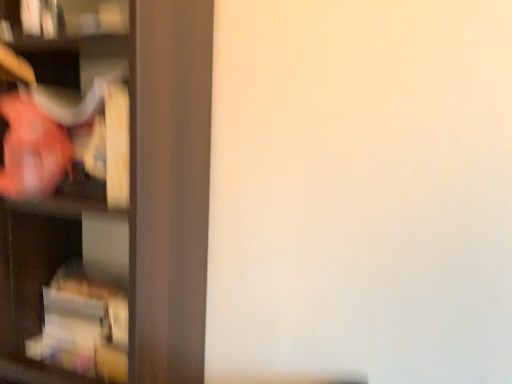
Question: Is matte brown shelf at left at the left side of matte plastic cabinet at left?

Choices:
 (A) yes
 (B) no

Answer: (B)

Question: From a real-world perspective, does matte brown shelf at left stand above matte plastic cabinet at left?

Choices:
 (A) yes
 (B) no

Answer: (A)

Question: Is matte brown shelf at left not inside matte plastic cabinet at left?

Choices:
 (A) yes
 (B) no

Answer: (A)

Question: Are matte brown shelf at left and matte plastic cabinet at left located far from each other?

Choices:
 (A) no
 (B) yes

Answer: (A)

Question: Considering the relative sizes of matte brown shelf at left and matte plastic cabinet at left in the image provided, is matte brown shelf at left bigger than matte plastic cabinet at left?

Choices:
 (A) yes
 (B) no

Answer: (A)

Question: Could you tell me if matte brown shelf at left is turned towards matte plastic cabinet at left?

Choices:
 (A) no
 (B) yes

Answer: (B)

Question: Is matte brown shelf at left at the back of matte plastic cabinet at left?

Choices:
 (A) yes
 (B) no

Answer: (A)

Question: Can you confirm if matte plastic cabinet at left is shorter than matte brown shelf at left?

Choices:
 (A) no
 (B) yes

Answer: (B)

Question: Is matte plastic cabinet at left not near matte brown shelf at left?

Choices:
 (A) no
 (B) yes

Answer: (A)

Question: Is matte plastic cabinet at left positioned in front of matte brown shelf at left?

Choices:
 (A) no
 (B) yes

Answer: (A)

Question: Can you confirm if matte plastic cabinet at left is bigger than matte brown shelf at left?

Choices:
 (A) yes
 (B) no

Answer: (B)

Question: From a real-world perspective, is matte plastic cabinet at left on matte brown shelf at left?

Choices:
 (A) yes
 (B) no

Answer: (B)

Question: Based on their sizes in the image, would you say matte brown shelf at left is bigger or smaller than matte plastic cabinet at left?

Choices:
 (A) small
 (B) big

Answer: (B)